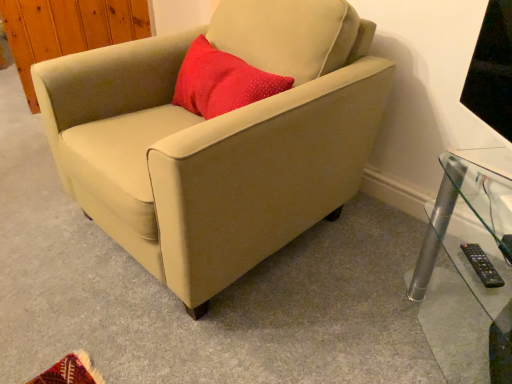
Identify the location of free space in front of beige fabric chair at center. (210, 326).